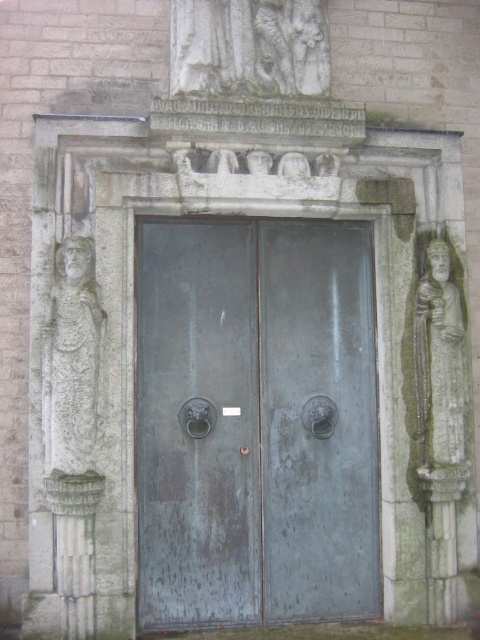
Question: Which of the following is the closest to the observer?

Choices:
 (A) pyautogui.click(x=421, y=376)
 (B) pyautogui.click(x=47, y=396)

Answer: (B)

Question: Estimate the real-world distances between objects in this image. Which object is farther from the carved stone figure at left?

Choices:
 (A) bronze/weathered metal door at center
 (B) green stone column at lower left
 (C) green stone statue at right

Answer: (C)

Question: Among these points, which one is farthest from the camera?

Choices:
 (A) (62, 611)
 (B) (60, 387)

Answer: (B)

Question: Can you confirm if bronze/weathered metal door at center is positioned to the left of green stone column at lower left?

Choices:
 (A) yes
 (B) no

Answer: (B)

Question: From the image, what is the correct spatial relationship of bronze/weathered metal door at center in relation to green stone statue at right?

Choices:
 (A) above
 (B) below

Answer: (B)

Question: Does carved stone figure at left have a lesser width compared to green stone column at lower left?

Choices:
 (A) no
 (B) yes

Answer: (A)